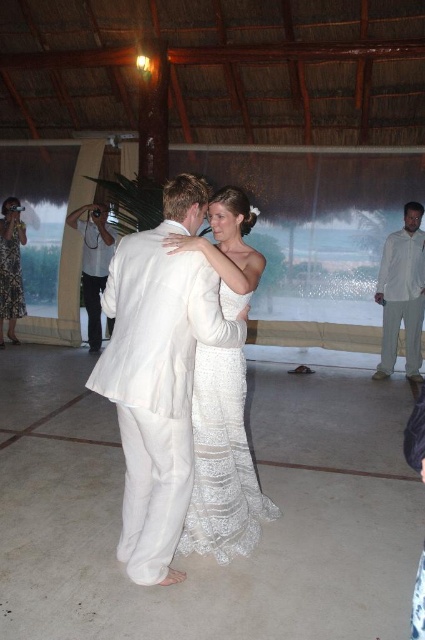
Which is above, white cotton camera at left or white lace dress at left?

white lace dress at left is above.

Looking at this image, is white cotton camera at left further to the viewer compared to white lace dress at left?

No, it is in front of white lace dress at left.

Who is more forward, (110, 324) or (25, 305)?

Point (25, 305) is more forward.

Where is `white cotton camera at left`? The image size is (425, 640). white cotton camera at left is located at coordinates (93, 262).

Does white linen suit at center have a lesser width compared to white lace dress at center?

No, white linen suit at center is not thinner than white lace dress at center.

Is white linen suit at center to the right of white lace dress at center from the viewer's perspective?

In fact, white linen suit at center is to the left of white lace dress at center.

Describe the element at coordinates (158, 374) in the screenshot. I see `white linen suit at center` at that location.

Locate an element on the screen. This screenshot has height=640, width=425. white linen suit at center is located at coordinates (158, 374).

Is white lace dress at center in front of white cotton camera at left?

Yes.

Where is `white lace dress at center`? white lace dress at center is located at coordinates (221, 461).

Locate an element on the screen. The image size is (425, 640). white lace dress at center is located at coordinates (221, 461).